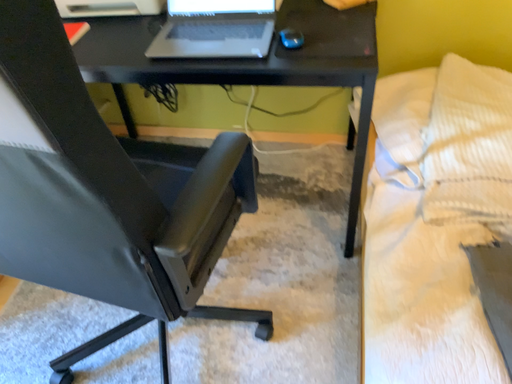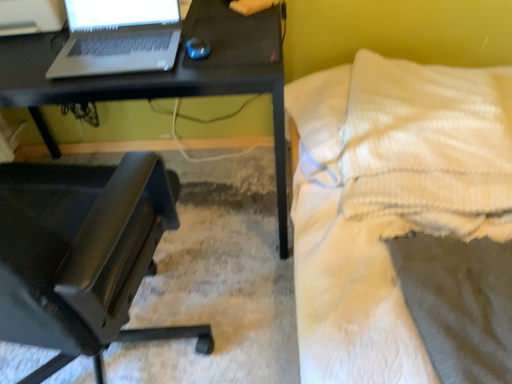
Question: How did the camera likely rotate when shooting the video?

Choices:
 (A) rotated right
 (B) rotated left

Answer: (A)